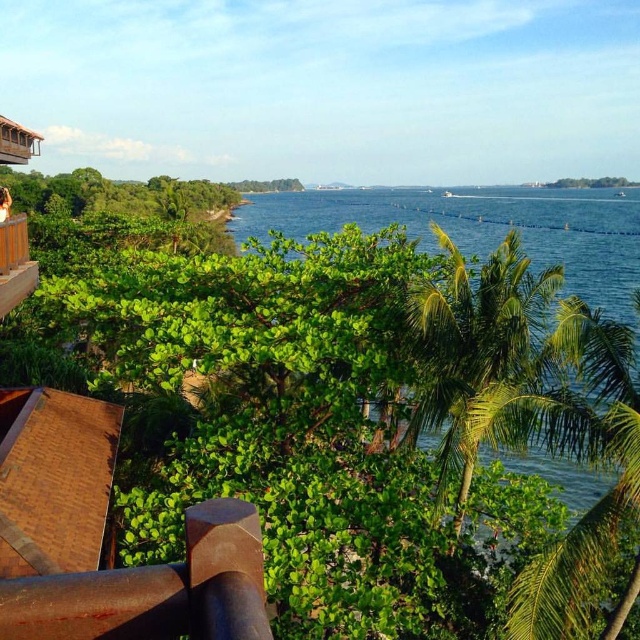
You are standing on the wooden balcony at upper left and want to place a 1.5 meter wide potted plant. Can the rusty metal stilt at lower left support the potted plant?

The rusty metal stilt at lower left has a width less than the wooden balcony at upper left. Since the potted plant is 1.5 meters wide, the stilt may not have enough space to securely support it. It is recommended to place the potted plant on the wooden balcony at upper left instead.

You are standing on the balcony looking at the serene coastal scene. There is a point marked at coordinates point (154, 589). What object is located at that point?

The point (154, 589) is located on the rusty metal stilt at lower left.